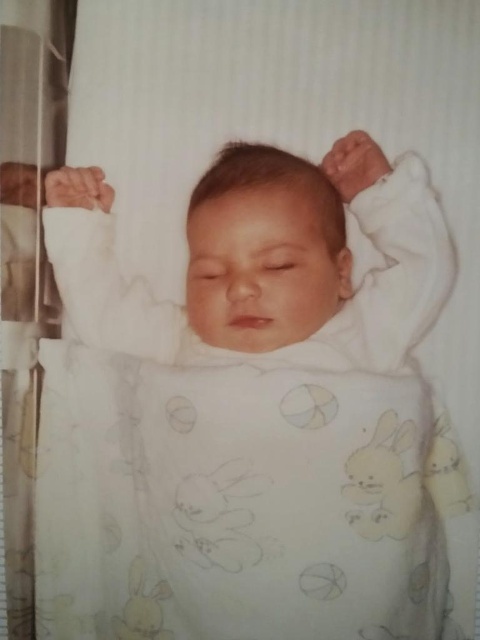
Locate an element on the screen. This screenshot has height=640, width=480. white soft blanket at center is located at coordinates (237, 502).

Between white soft blanket at center and white soft newborn at center, which one has less height?

With less height is white soft newborn at center.

Between point (177, 627) and point (204, 330), which one is positioned behind?

The point (204, 330) is more distant.

Identify the location of white soft blanket at center. This screenshot has height=640, width=480. (237, 502).